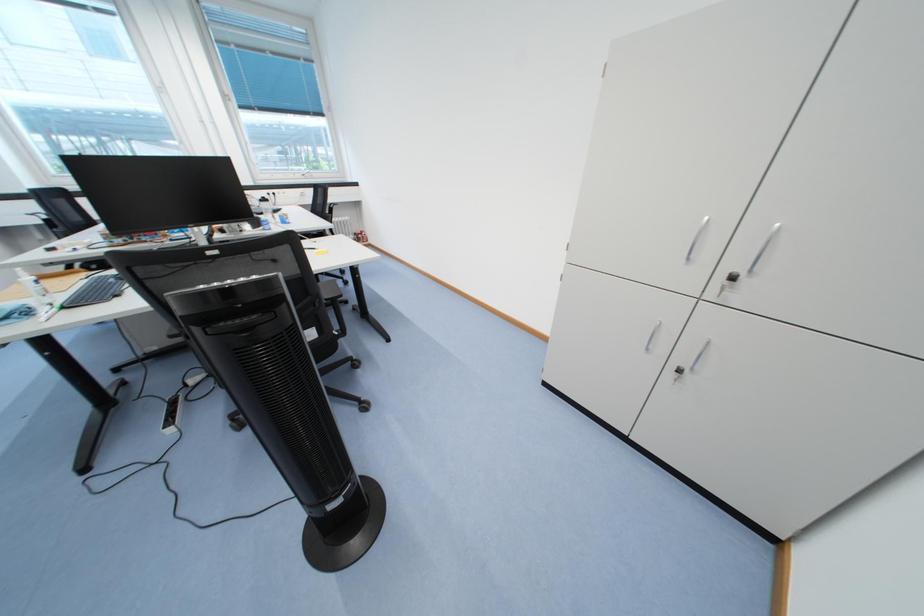
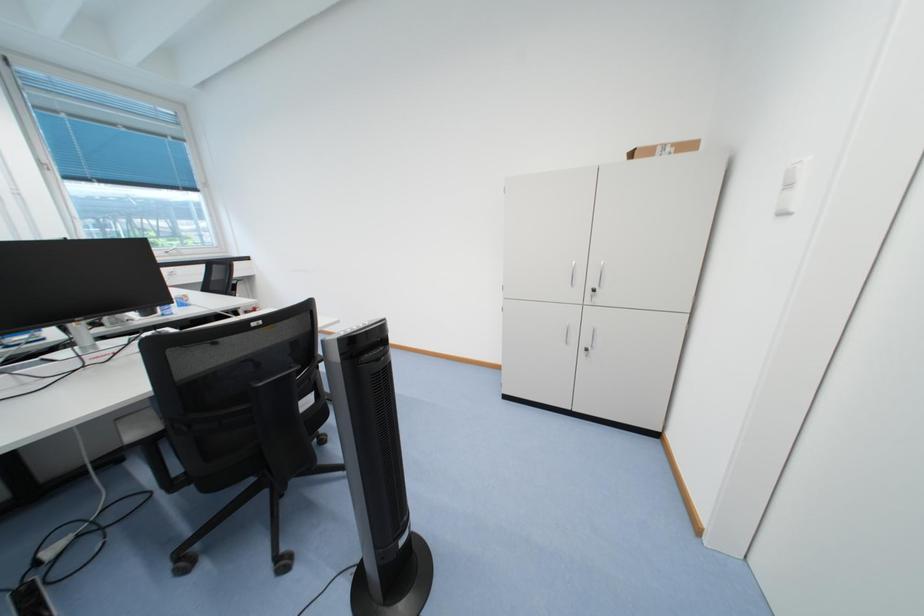
Question: How did the camera likely rotate?

Choices:
 (A) Left
 (B) Right
 (C) Up
 (D) Down

Answer: (B)